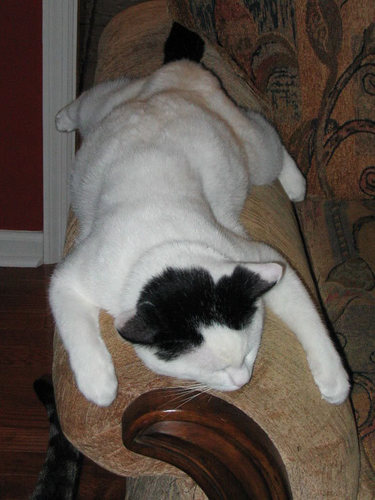
This screenshot has height=500, width=375. What are the coordinates of `white trim` in the screenshot? It's located at (62, 67).